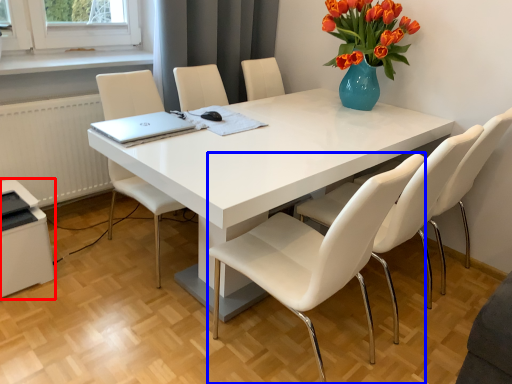
Question: Among these objects, which one is farthest to the camera, printer (highlighted by a red box) or chair (highlighted by a blue box)?

Choices:
 (A) printer
 (B) chair

Answer: (A)